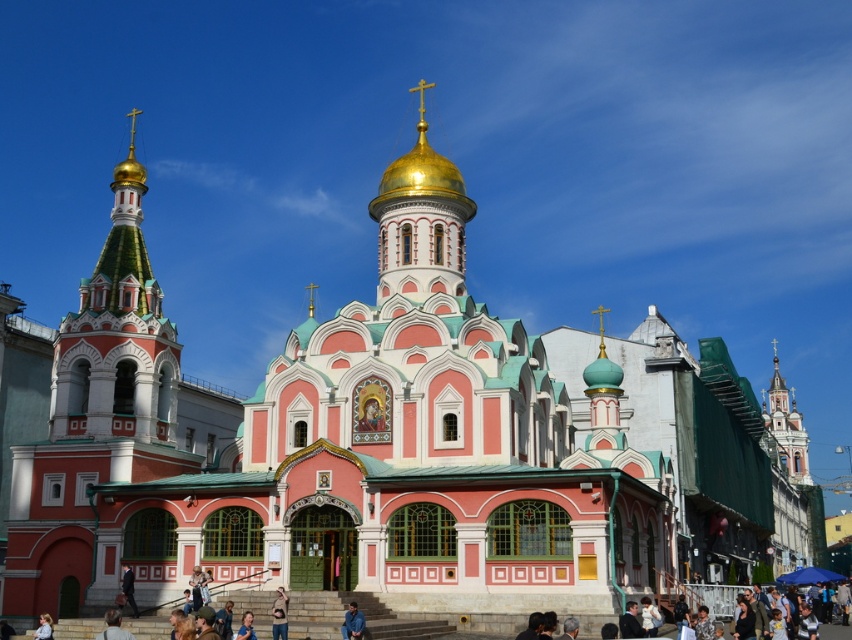
Can you confirm if dark brown leather coat at lower left is positioned below light blue shirt at lower left?

No.

Is point (127, 577) farther from viewer compared to point (37, 637)?

Yes, it is.

Locate an element on the screen. dark brown leather coat at lower left is located at coordinates (128, 588).

Does point (278, 595) come behind point (251, 620)?

That is True.

Is brown fabric shirt at lower center smaller than light brown leather jacket at lower center?

No, brown fabric shirt at lower center is not smaller than light brown leather jacket at lower center.

Does point (281, 600) come behind point (245, 627)?

Yes.

The height and width of the screenshot is (640, 852). What are the coordinates of `brown fabric shirt at lower center` in the screenshot? It's located at pos(279,614).

Is blue denim jeans at lower center shorter than light brown leather jacket at lower center?

In fact, blue denim jeans at lower center may be taller than light brown leather jacket at lower center.

Describe the element at coordinates (352, 621) in the screenshot. I see `blue denim jeans at lower center` at that location.

Locate an element on the screen. blue denim jeans at lower center is located at coordinates (352, 621).